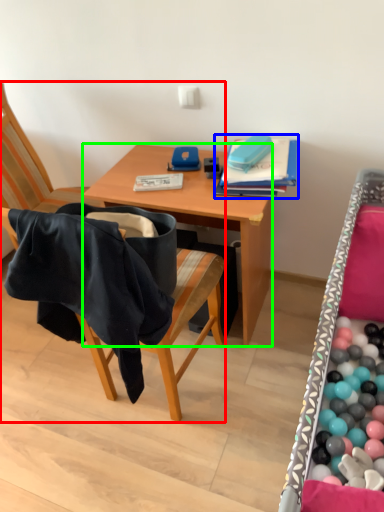
Question: Based on their relative distances, which object is nearer to chair (highlighted by a red box)? Choose from book (highlighted by a blue box) and desk (highlighted by a green box).

Choices:
 (A) book
 (B) desk

Answer: (B)